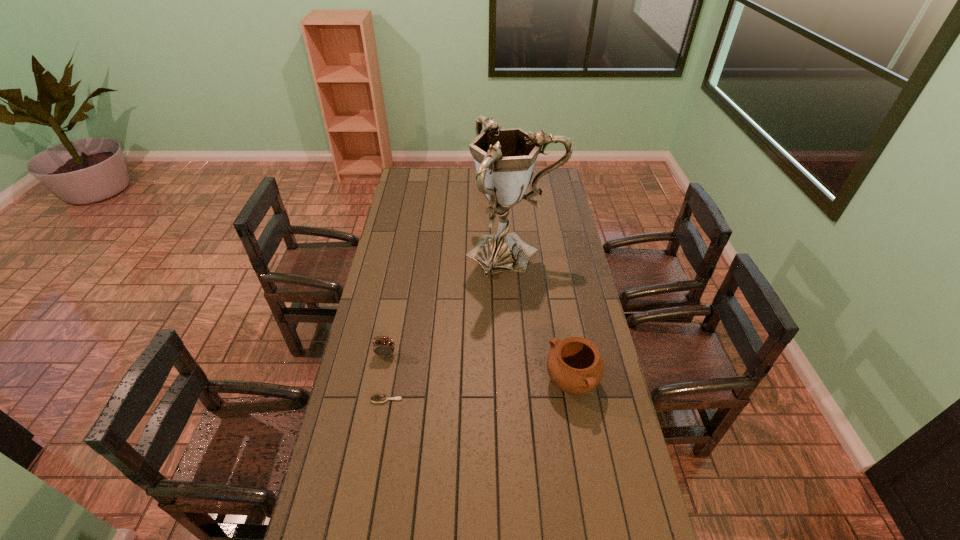
The height and width of the screenshot is (540, 960). Find the location of `the tallest object`. the tallest object is located at coordinates (504, 158).

Locate an element on the screen. The width and height of the screenshot is (960, 540). trophy cup is located at coordinates (504, 158).

At what (x,y) coordinates should I click in order to perform the action: click on the farthest object. Please return your answer as a coordinate pair (x, y). Looking at the image, I should click on [x=500, y=127].

The height and width of the screenshot is (540, 960). Find the location of `oil lamp`. oil lamp is located at coordinates (500, 127).

At what (x,y) coordinates should I click in order to perform the action: click on the third tallest object. Please return your answer as a coordinate pair (x, y). This screenshot has height=540, width=960. Looking at the image, I should click on (574, 365).

Locate an element on the screen. the second shortest object is located at coordinates (384, 347).

Find the location of a particular element. This screenshot has width=960, height=540. the third nearest object is located at coordinates click(x=384, y=347).

Where is `scrubbing brush`? This screenshot has width=960, height=540. scrubbing brush is located at coordinates (378, 398).

At what (x,y) coordinates should I click in order to perform the action: click on free space located 0.210m on the left of the fourth nearest object. Please return your answer as a coordinate pair (x, y). Looking at the image, I should click on (420, 253).

At what (x,y) coordinates should I click in order to perform the action: click on vacant space located on the front of the farthest object. Please return your answer as a coordinate pair (x, y). This screenshot has width=960, height=540. Looking at the image, I should click on (494, 199).